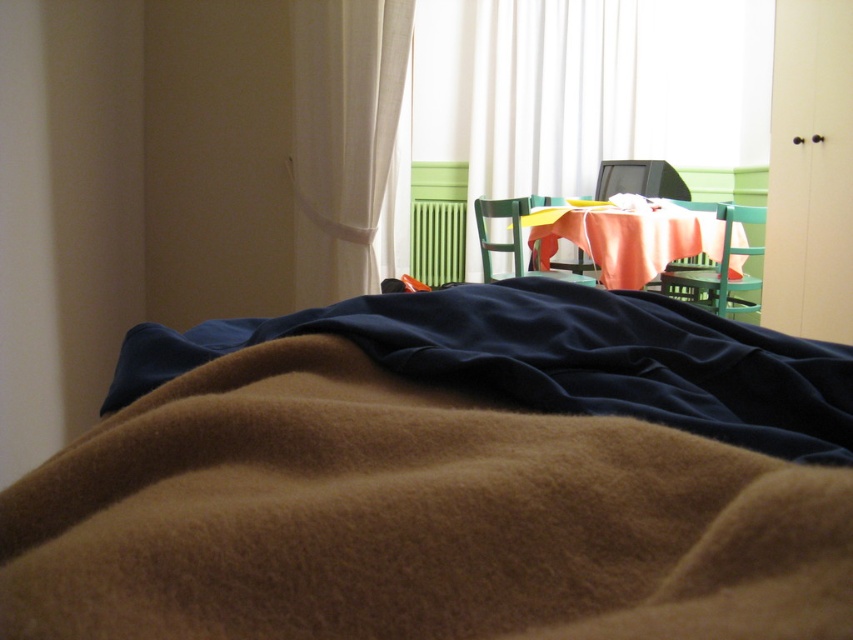
You are trying to decide whether to place a small plant on the table between the white fabric curtain at upper left and the green plastic chair at center. Based on their positions, which object is closer to the table?

The white fabric curtain at upper left is closer to the table because it is in front of the green plastic chair at center, meaning it is nearer to the table.

You are standing in the dining area and looking towards the bed. Where is the white fabric curtain at upper left located in relation to your current position?

The white fabric curtain at upper left is located at point (345, 140) in the scene.